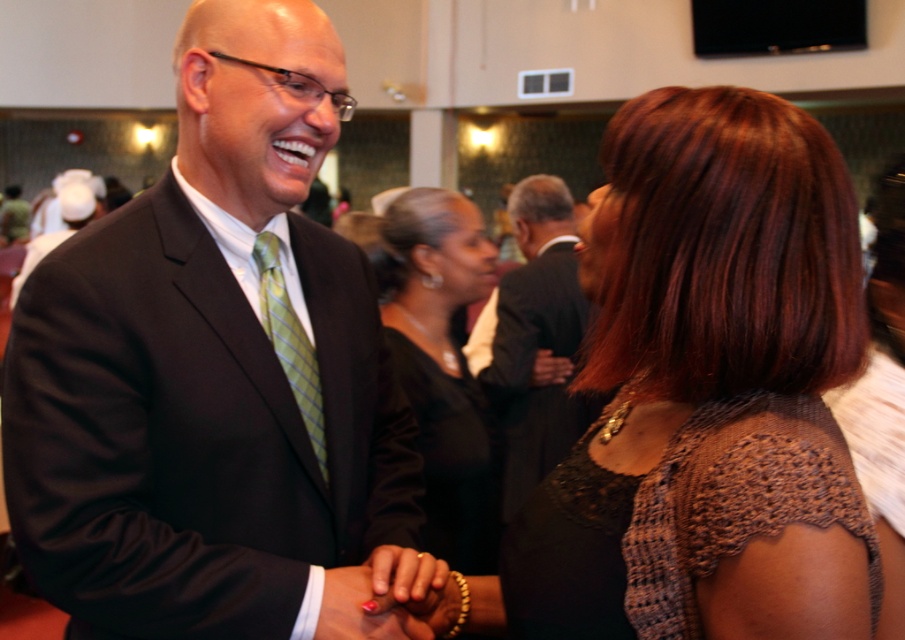
Consider the image. You are at a formal event and notice two people at the center of the scene. The man is wearing a dark brown suit at center and a green plaid tie at center. From your perspective, which clothing item is positioned more to the right?

The dark brown suit at center is positioned more to the right than the green plaid tie at center.

You are a photographer at a formal event. You need to capture a closeup shot of the polished pink nail at center without including the matte black suit at center in the frame. Given that your camera has a focal length of 50mm and the minimum focusing distance is 1 meter, can you position yourself appropriately to achieve this?

The distance between the matte black suit at center and polished pink nail at center is 14.20 inches. Since the minimum focusing distance is 1 meter, which is approximately 39.37 inches, you can position yourself at least 1 meter away from the polished pink nail at center. This distance ensures the matte black suit at center will be out of the frame as it is only 14.20 inches away from the nail. Thus, the shot is achievable.